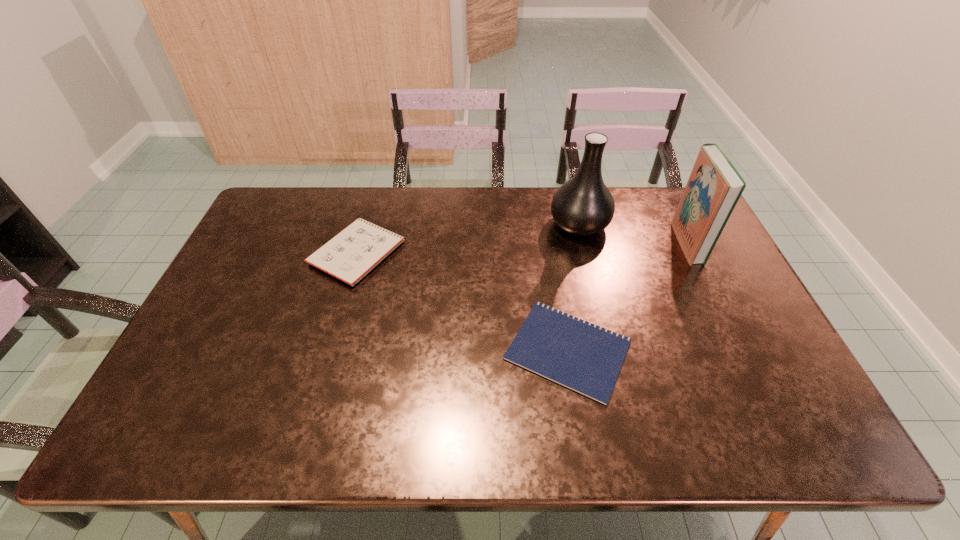
Identify the location of free point located on the back of the left notepad. The image size is (960, 540). (370, 211).

Locate an element on the screen. free location located 0.260m on the left of the nearer notepad is located at coordinates (401, 350).

Locate an element on the screen. vase at the far edge is located at coordinates (583, 206).

Identify the location of hardback book located at the far edge. The height and width of the screenshot is (540, 960). (714, 187).

You are a GUI agent. You are given a task and a screenshot of the screen. Output one action in this format:
    pyautogui.click(x=<x>, y=<y>)
    Task: Click on the notepad located at the far edge
    
    Given the screenshot: What is the action you would take?
    pyautogui.click(x=351, y=254)

Find the location of a particular element. object present at the right edge is located at coordinates (714, 187).

Image resolution: width=960 pixels, height=540 pixels. Find the location of `object present at the far right corner`. object present at the far right corner is located at coordinates (714, 187).

At what (x,y) coordinates should I click in order to perform the action: click on vacant space at the far edge. Please return your answer as a coordinate pair (x, y). The image size is (960, 540). Looking at the image, I should click on (443, 193).

Locate an element on the screen. The image size is (960, 540). vacant space at the near edge is located at coordinates (249, 414).

The height and width of the screenshot is (540, 960). Identify the location of free space at the left edge of the desktop. (260, 256).